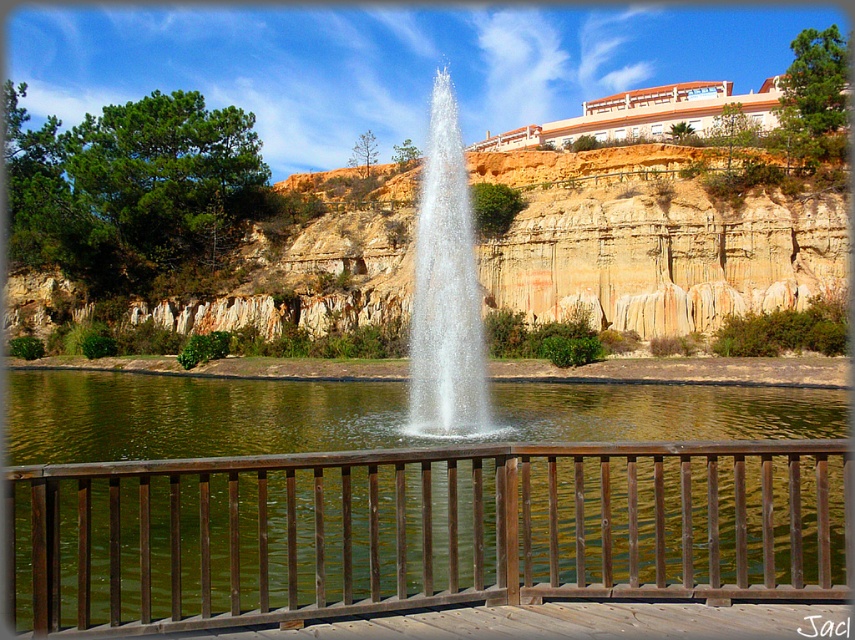
Does brown wooden railing at center have a smaller size compared to clear water fountain at center?

Indeed, brown wooden railing at center has a smaller size compared to clear water fountain at center.

Does point (481, 467) lie behind point (473, 323)?

That is False.

Find the location of `brown wooden railing at center`. brown wooden railing at center is located at coordinates 420,531.

Between point (305, 464) and point (223, 323), which one is positioned behind?

Point (223, 323)

Can you confirm if brown wooden railing at center is taller than clay-colored rock at center?

No, brown wooden railing at center is not taller than clay-colored rock at center.

What are the coordinates of `brown wooden railing at center` in the screenshot? It's located at (420, 531).

Between clay-colored rock at center and clear water fountain at center, which one is positioned lower?

clay-colored rock at center is lower down.

Who is more distant from viewer, (797, 275) or (443, 212)?

The point (797, 275) is behind.

Does point (680, 301) come closer to viewer compared to point (434, 156)?

Yes, it is in front of point (434, 156).

At what (x,y) coordinates should I click in order to perform the action: click on clay-colored rock at center. Please return your answer as a coordinate pair (x, y). Looking at the image, I should click on (655, 243).